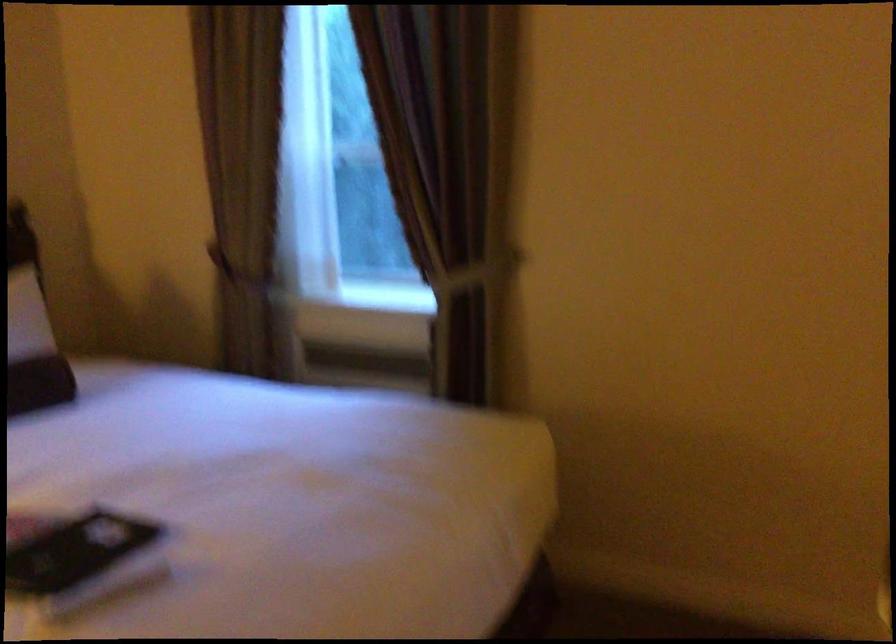
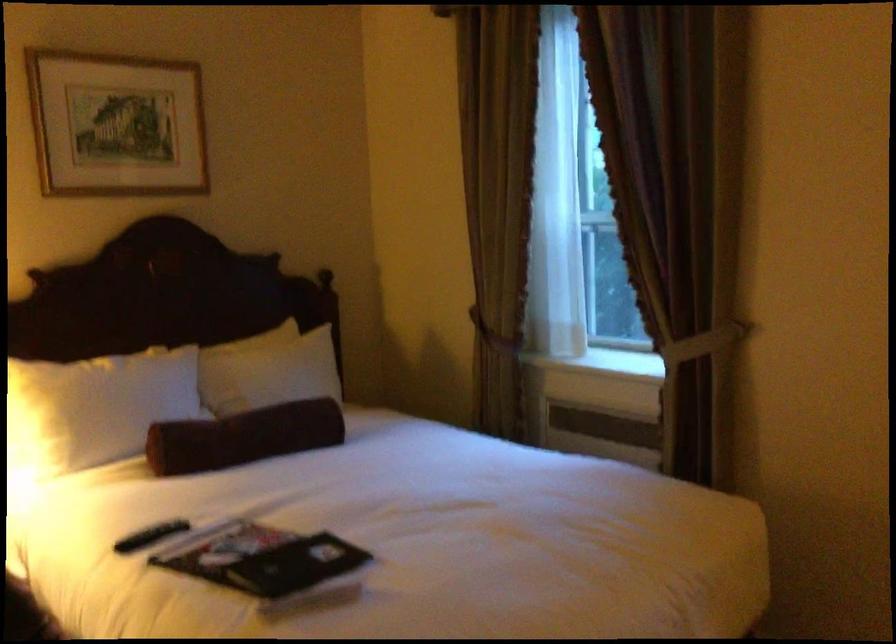
Where in the second image is the point corresponding to the point at 458,276 from the first image?

(686, 348)